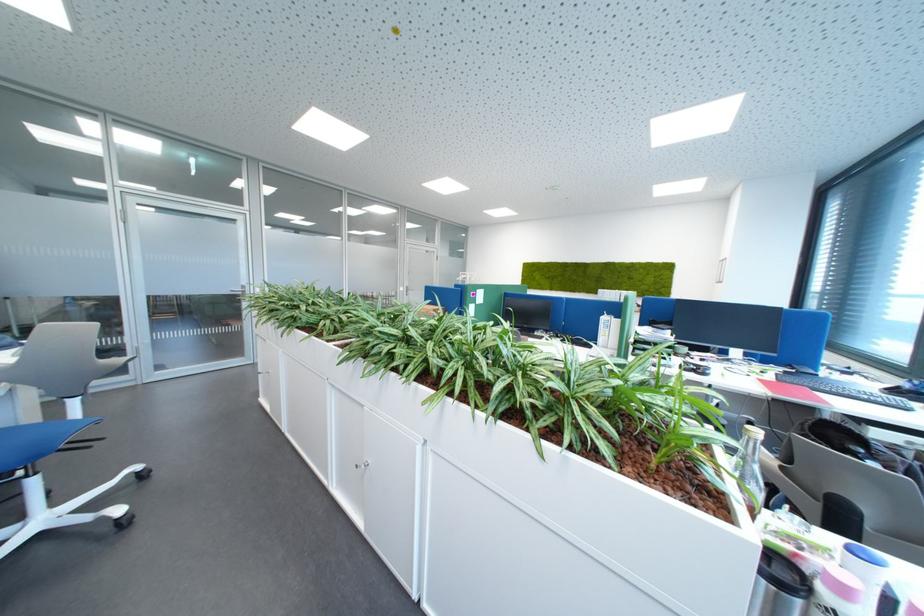
Image resolution: width=924 pixels, height=616 pixels. I want to click on metal door handle, so click(x=361, y=464).